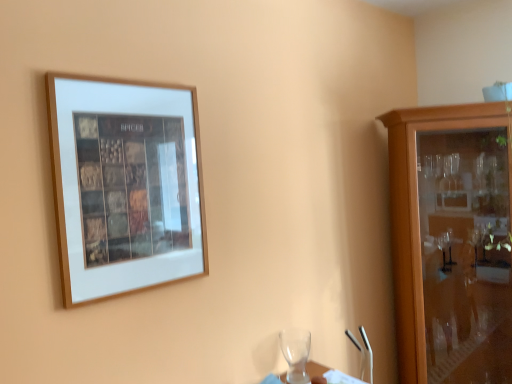
Question: Choose the correct answer: Is transparent glass wine glass at lower center inside wooden picture frame at upper left or outside it?

Choices:
 (A) inside
 (B) outside

Answer: (B)

Question: In terms of height, does transparent glass wine glass at lower center look taller or shorter compared to wooden picture frame at upper left?

Choices:
 (A) short
 (B) tall

Answer: (A)

Question: Which object is positioned farthest from the wooden cabinet at right?

Choices:
 (A) wooden picture frame at upper left
 (B) transparent glass wine glass at lower center

Answer: (A)

Question: Considering the real-world distances, which object is closest to the wooden cabinet at right?

Choices:
 (A) wooden picture frame at upper left
 (B) transparent glass wine glass at lower center

Answer: (B)